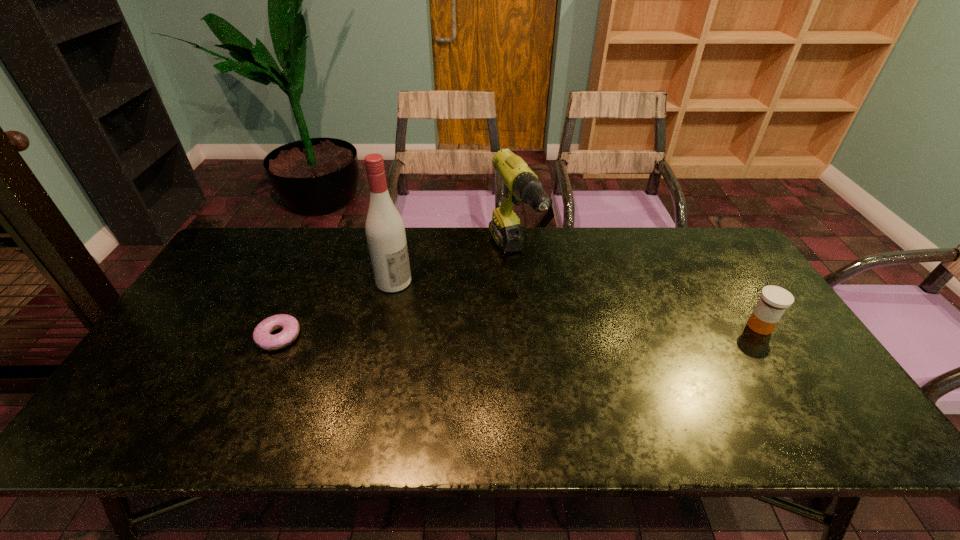
The width and height of the screenshot is (960, 540). In order to click on vacant space at the near edge of the desktop in this screenshot , I will do `click(420, 399)`.

Identify the location of vacant space at the right edge. (773, 344).

What are the coordinates of `vacant region at the far left corner` in the screenshot? It's located at (232, 252).

In the image, there is a desktop. What are the coordinates of `free space at the far right corner` in the screenshot? It's located at (717, 272).

Identify the location of vacant space at the near right corner of the desktop. (787, 392).

You are a GUI agent. You are given a task and a screenshot of the screen. Output one action in this format:
    pyautogui.click(x=<x>, y=<y>)
    Task: Click on the blank region between the third object from left to right and the shortest object
    
    Given the screenshot: What is the action you would take?
    pyautogui.click(x=396, y=297)

Image resolution: width=960 pixels, height=540 pixels. I want to click on free spot between the third shortest object and the medicine, so click(636, 292).

Identify the location of vacant area between the second object from right to left and the second shortest object. (636, 292).

Locate an element on the screen. The image size is (960, 540). vacant region between the rightmost object and the tallest object is located at coordinates (577, 304).

At what (x,y) coordinates should I click in order to perform the action: click on empty space between the shortest object and the second object from left to right. Please return your answer as a coordinate pair (x, y). The image size is (960, 540). Looking at the image, I should click on (336, 309).